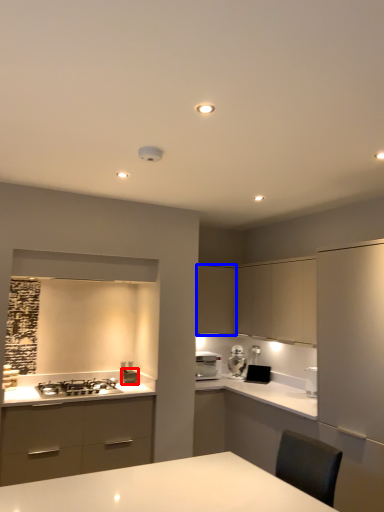
Question: Which point is further to the camera, appliance (highlighted by a red box) or cabinetry (highlighted by a blue box)?

Choices:
 (A) appliance
 (B) cabinetry

Answer: (B)